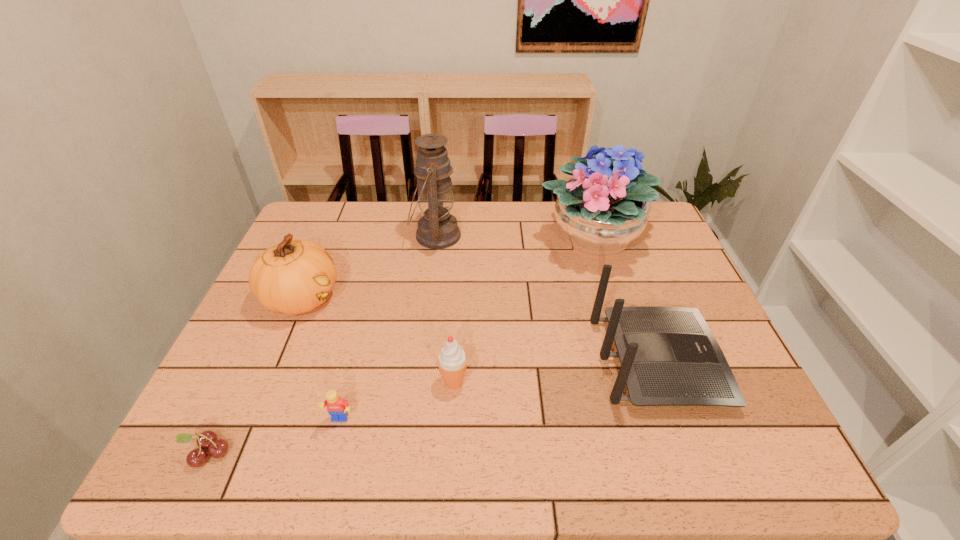
Find the location of a particular element. The width and height of the screenshot is (960, 540). the sixth closest object to the router is located at coordinates (208, 439).

What are the coordinates of `object that is the closest to the oil lamp` in the screenshot? It's located at (295, 276).

Identify the location of free region that satisfies the following two spatial constraints: 1. on the front face of the pumpkin; 2. on the right side of the third shortest object. (267, 382).

Find the location of `free space that satisfies the following two spatial constraints: 1. on the front face of the pumpkin; 2. on the leaves of the cherry`. free space that satisfies the following two spatial constraints: 1. on the front face of the pumpkin; 2. on the leaves of the cherry is located at coordinates (236, 453).

The image size is (960, 540). In order to click on vacant region that satisfies the following two spatial constraints: 1. on the front face of the icecream; 2. on the right side of the pumpkin in this screenshot , I will do `click(267, 382)`.

At what (x,y) coordinates should I click in order to perform the action: click on free space that satisfies the following two spatial constraints: 1. on the back side of the icecream; 2. on the front face of the pumpkin. Please return your answer as a coordinate pair (x, y). Looking at the image, I should click on (458, 298).

Locate an element on the screen. free space that satisfies the following two spatial constraints: 1. on the front face of the pumpkin; 2. on the leaves of the nearest object is located at coordinates (236, 453).